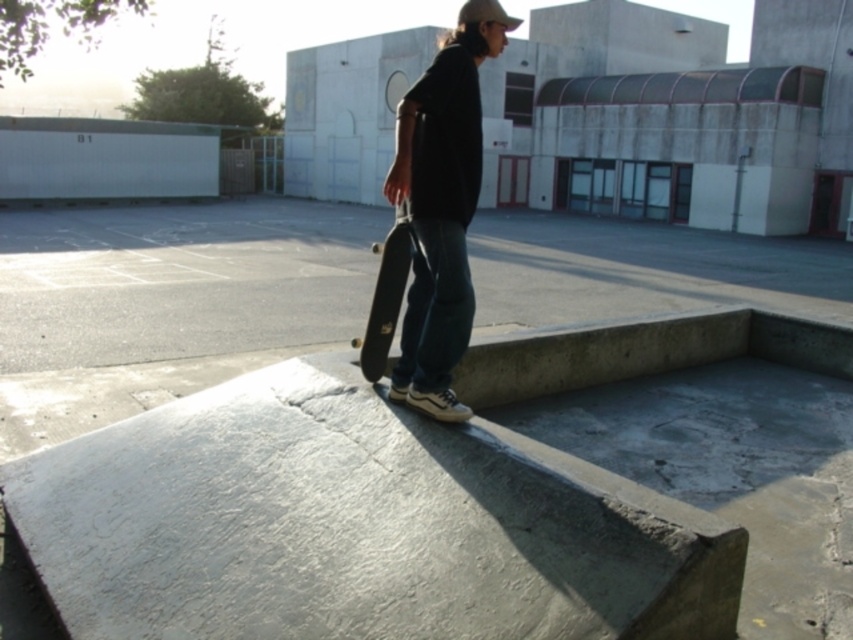
Question: Is matte black skateboard at center above black smooth skateboard at center?

Choices:
 (A) no
 (B) yes

Answer: (A)

Question: Among these objects, which one is nearest to the camera?

Choices:
 (A) matte black skateboard at center
 (B) black smooth skateboard at center

Answer: (A)

Question: Can you confirm if matte black skateboard at center is positioned to the right of black smooth skateboard at center?

Choices:
 (A) no
 (B) yes

Answer: (B)

Question: Is matte black skateboard at center bigger than black smooth skateboard at center?

Choices:
 (A) no
 (B) yes

Answer: (B)

Question: Which object is farther from the camera taking this photo?

Choices:
 (A) matte black skateboard at center
 (B) black smooth skateboard at center

Answer: (B)